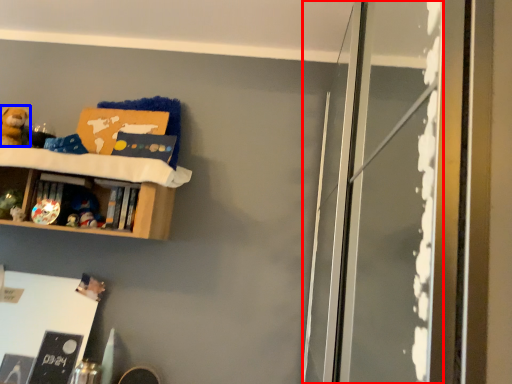
Question: Which object appears farthest to the camera in this image, screen door (highlighted by a red box) or toy (highlighted by a blue box)?

Choices:
 (A) screen door
 (B) toy

Answer: (B)